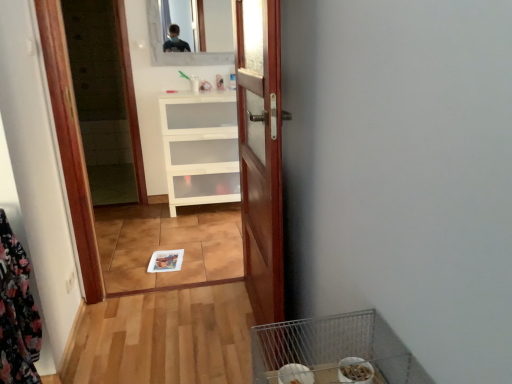
Question: Considering the positions of white matte cabinet at center and metallic wire bird cage at lower right in the image, is white matte cabinet at center bigger or smaller than metallic wire bird cage at lower right?

Choices:
 (A) small
 (B) big

Answer: (B)

Question: Is white matte cabinet at center wider or thinner than metallic wire bird cage at lower right?

Choices:
 (A) wide
 (B) thin

Answer: (A)

Question: Based on their relative distances, which object is nearer to the wooden door at center?

Choices:
 (A) floral fabric laundry at left
 (B) white matte cabinet at center
 (C) clear glass mirror at upper center
 (D) metallic wire bird cage at lower right

Answer: (D)

Question: Estimate the real-world distances between objects in this image. Which object is closer to the metallic wire bird cage at lower right?

Choices:
 (A) wooden door at center
 (B) floral fabric laundry at left
 (C) white matte cabinet at center
 (D) clear glass mirror at upper center

Answer: (A)